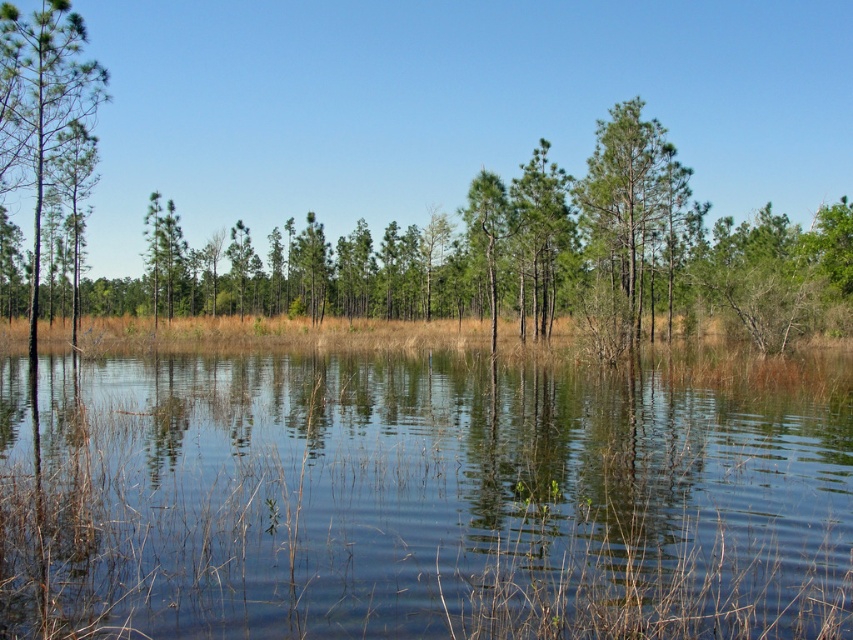
Question: Which point is closer to the camera taking this photo?

Choices:
 (A) (601, 125)
 (B) (57, 88)

Answer: (B)

Question: Is clear water at center further to camera compared to green matte tree at center?

Choices:
 (A) no
 (B) yes

Answer: (A)

Question: Which point is farther to the camera?

Choices:
 (A) clear water at center
 (B) green matte tree at center
 (C) green matte tree at left

Answer: (B)

Question: Is clear water at center below green matte tree at center?

Choices:
 (A) no
 (B) yes

Answer: (B)

Question: Is green matte tree at center wider than green matte tree at left?

Choices:
 (A) yes
 (B) no

Answer: (A)

Question: Which of these objects is positioned farthest from the green matte tree at center?

Choices:
 (A) clear water at center
 (B) green matte tree at left

Answer: (B)